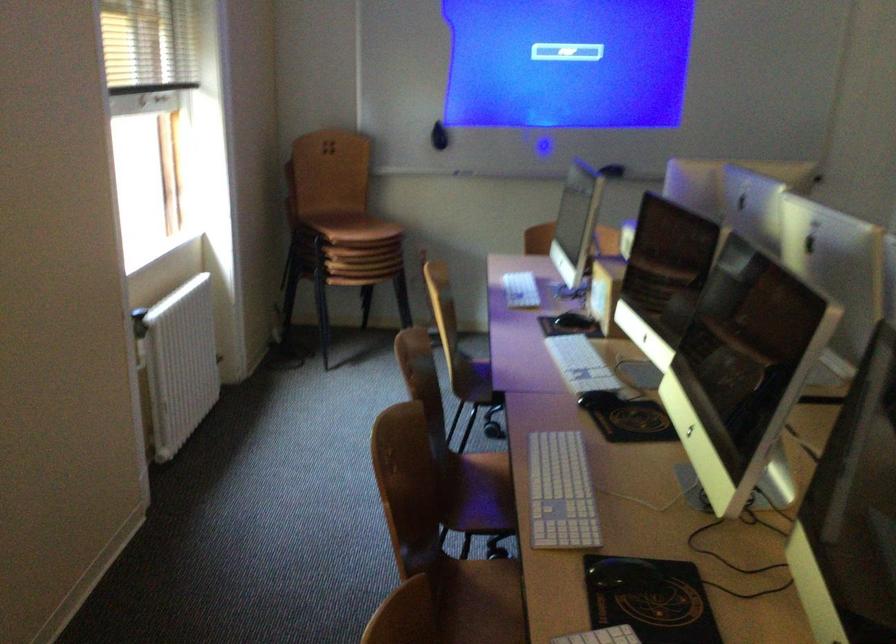
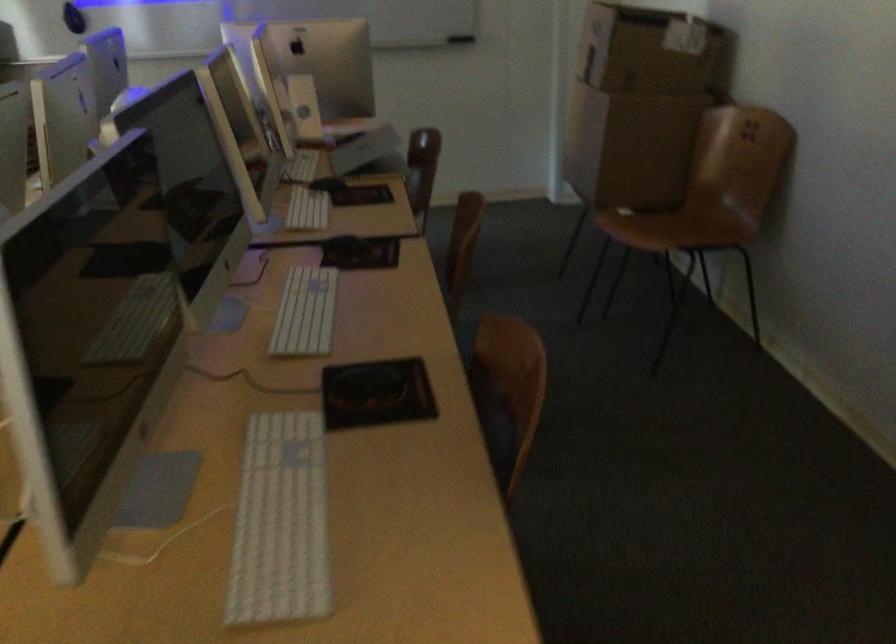
Question: Which direction would the cameraman need to move to produce the second image? Reply with the corresponding letter.

Choices:
 (A) Left
 (B) Right
 (C) Forward
 (D) Backward

Answer: (B)